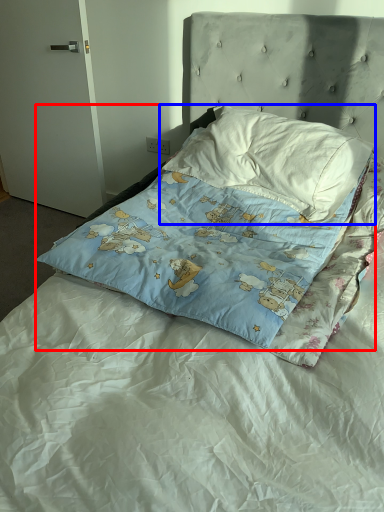
Question: Which point is further to the camera, pillow (highlighted by a red box) or pillow (highlighted by a blue box)?

Choices:
 (A) pillow
 (B) pillow

Answer: (B)